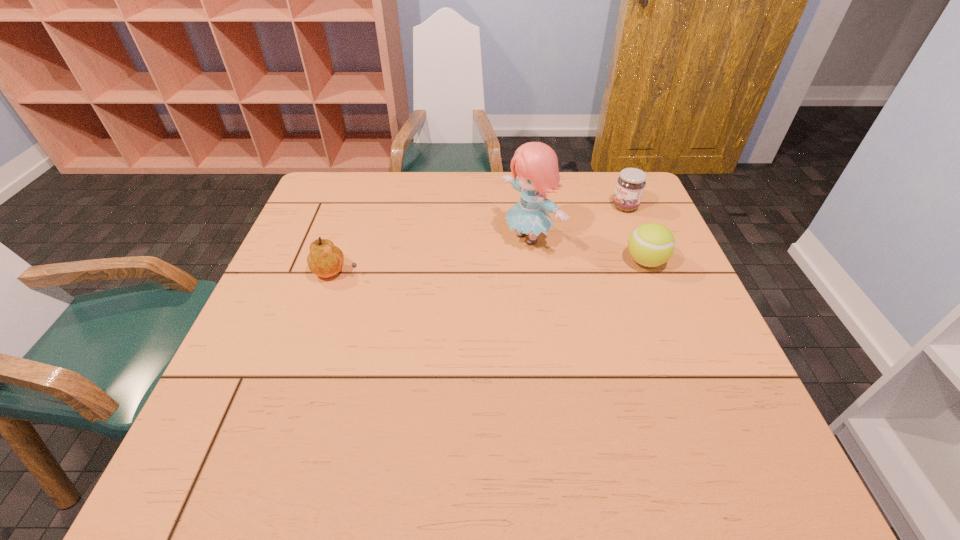
This screenshot has width=960, height=540. I want to click on vacant space located 0.180m on the front-facing side of the third object from right to left, so click(x=451, y=279).

This screenshot has width=960, height=540. I want to click on free point located on the front-facing side of the third object from right to left, so click(413, 298).

Where is `free space located 0.070m on the front-facing side of the third object from right to left`? This screenshot has width=960, height=540. free space located 0.070m on the front-facing side of the third object from right to left is located at coordinates 487,262.

Locate an element on the screen. jam that is at the far edge is located at coordinates (630, 185).

Locate an element on the screen. This screenshot has height=540, width=960. doll situated at the far edge is located at coordinates (536, 164).

I want to click on object at the left edge, so click(325, 260).

You are a GUI agent. You are given a task and a screenshot of the screen. Output one action in this format:
    pyautogui.click(x=<x>, y=<y>)
    Task: Click on the tennis ball located in the right edge section of the desktop
    
    Given the screenshot: What is the action you would take?
    pyautogui.click(x=651, y=244)

In order to click on jam located at the right edge in this screenshot , I will do `click(630, 185)`.

Where is `object present at the far right corner`? Image resolution: width=960 pixels, height=540 pixels. object present at the far right corner is located at coordinates (630, 185).

Identify the location of free space at the far edge. This screenshot has height=540, width=960. (454, 193).